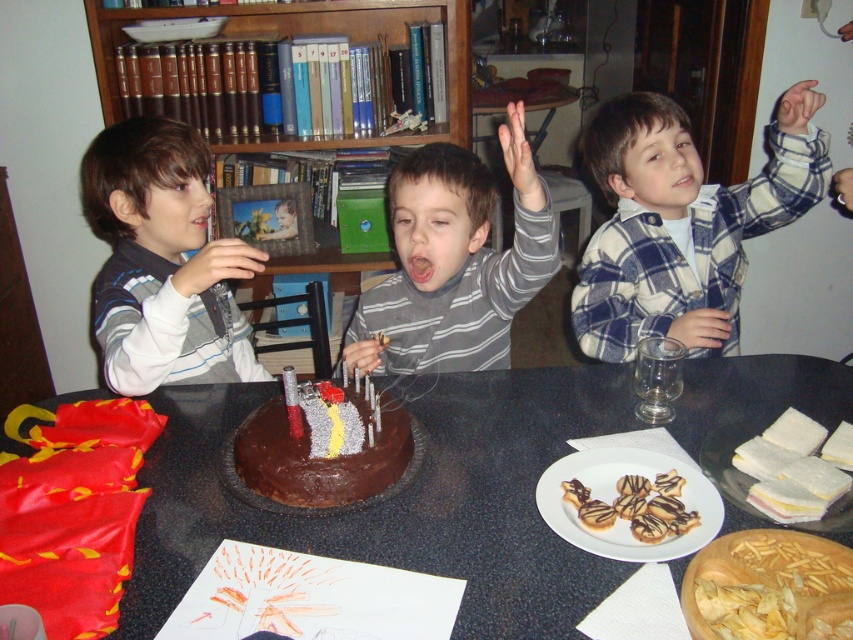
You are a photographer trying to capture a group photo of the blue plaid shirt at upper right and the matte gray sweater at left. The camera you are using has a maximum focus range of 35 inches. Will both subjects be in focus if you position the camera exactly between them?

The blue plaid shirt at upper right is 34.79 inches from the matte gray sweater at left. Since the distance between them is within the camera maximum focus range of 35 inches, positioning the camera exactly between them will ensure both subjects are in focus.

Based on the photo, you are a photographer at the birthday party and need to capture a photo of both the blue plaid shirt at upper right and the matte gray sweater at left. Which direction should you move your camera to include both in the frame?

To include both the blue plaid shirt at upper right and the matte gray sweater at left in the frame, you should move your camera to the left since the blue plaid shirt at upper right is positioned on the right side of the matte gray sweater at left.